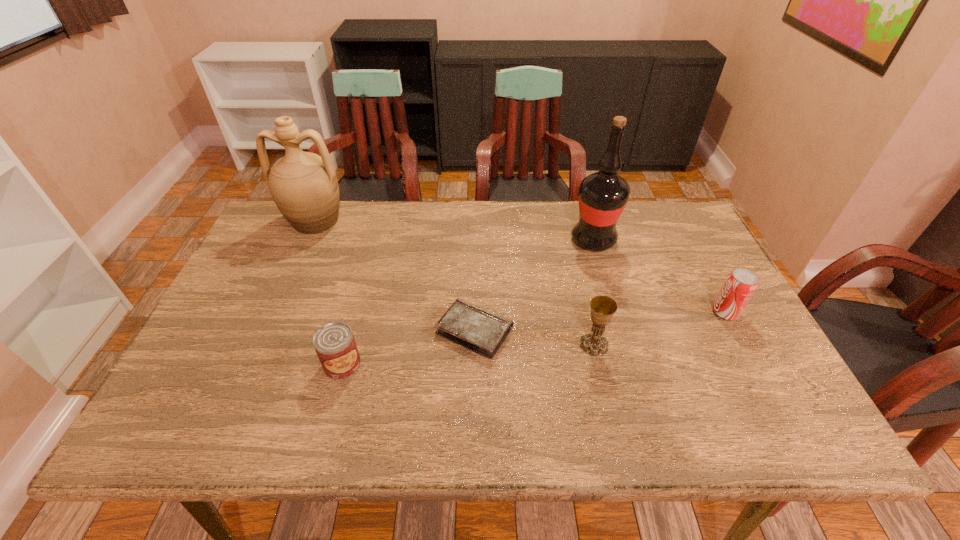
You are a GUI agent. You are given a task and a screenshot of the screen. Output one action in this format:
    pyautogui.click(x=<x>, y=<y>)
    Task: Click on the free space that satisfies the following two spatial constraints: 1. on the back side of the wine bottle; 2. on the right side of the diary
    
    Given the screenshot: What is the action you would take?
    pyautogui.click(x=475, y=240)

The image size is (960, 540). I want to click on free space that satisfies the following two spatial constraints: 1. on the front side of the leftmost object; 2. on the right side of the wine bottle, so click(x=306, y=240).